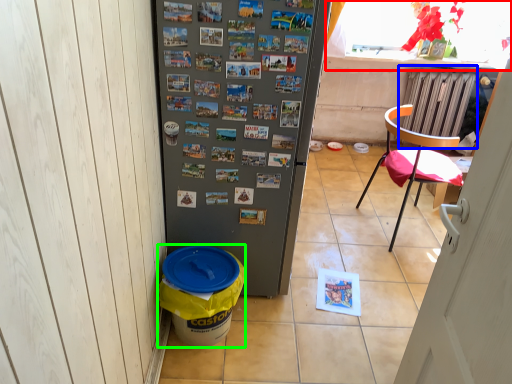
Question: Which object is the farthest from window screen (highlighted by a red box)? Choose among these: radiator (highlighted by a blue box) or recycling bin (highlighted by a green box).

Choices:
 (A) radiator
 (B) recycling bin

Answer: (B)